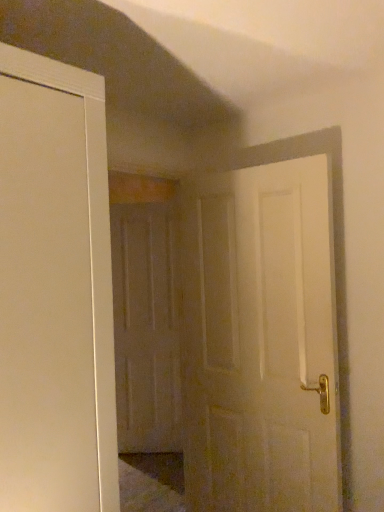
Question: Should I look upward or downward to see white matte door at center, which ranks as the first door in right-to-left order?

Choices:
 (A) up
 (B) down

Answer: (B)

Question: From the image's perspective, is white matte door at center, which ranks as the first door in right-to-left order, beneath matte wooden door at center, acting as the 2th door starting from the front?

Choices:
 (A) yes
 (B) no

Answer: (B)

Question: Is white matte door at center, positioned as the 2th door in back-to-front order, positioned before matte wooden door at center, which is the second door from right to left?

Choices:
 (A) yes
 (B) no

Answer: (A)

Question: Considering the relative sizes of white matte door at center, positioned as the 2th door in back-to-front order, and matte wooden door at center, which is the second door from right to left, in the image provided, is white matte door at center, positioned as the 2th door in back-to-front order, wider than matte wooden door at center, which is the second door from right to left,?

Choices:
 (A) no
 (B) yes

Answer: (B)

Question: Considering the relative positions of white matte door at center, positioned as the 2th door in back-to-front order, and matte wooden door at center, acting as the 2th door starting from the front, in the image provided, is white matte door at center, positioned as the 2th door in back-to-front order, to the right of matte wooden door at center, acting as the 2th door starting from the front, from the viewer's perspective?

Choices:
 (A) no
 (B) yes

Answer: (B)

Question: From a real-world perspective, does white matte door at center, which ranks as the first door in right-to-left order, sit lower than matte wooden door at center, which is counted as the 1th door, starting from the back?

Choices:
 (A) yes
 (B) no

Answer: (B)

Question: Can matte wooden door at center, which is the second door from right to left, be found inside white matte door at center, positioned as the 2th door in back-to-front order?

Choices:
 (A) no
 (B) yes

Answer: (A)

Question: Can you confirm if matte wooden door at center, which is counted as the 1th door, starting from the back, is bigger than white matte door at center, the 1th door viewed from the front?

Choices:
 (A) yes
 (B) no

Answer: (B)

Question: Can you see matte wooden door at center, acting as the 2th door starting from the front, touching white matte door at center, which ranks as the first door in right-to-left order?

Choices:
 (A) yes
 (B) no

Answer: (B)

Question: Is matte wooden door at center, which is counted as the 1th door, starting from the back, outside white matte door at center, positioned as the 2th door in back-to-front order?

Choices:
 (A) no
 (B) yes

Answer: (B)

Question: Can you confirm if matte wooden door at center, which is the second door from right to left, is shorter than white matte door at center, the 1th door viewed from the front?

Choices:
 (A) no
 (B) yes

Answer: (A)

Question: Considering the relative positions of matte wooden door at center, which is counted as the 1th door, starting from the back, and white matte door at center, placed as the 2th door when sorted from left to right, in the image provided, is matte wooden door at center, which is counted as the 1th door, starting from the back, to the right of white matte door at center, placed as the 2th door when sorted from left to right, from the viewer's perspective?

Choices:
 (A) yes
 (B) no

Answer: (B)

Question: Can you confirm if matte wooden door at center, which is counted as the 1th door, starting from the back, is wider than white matte door at center, which ranks as the first door in right-to-left order?

Choices:
 (A) no
 (B) yes

Answer: (A)

Question: From the image's perspective, is white matte door at center, positioned as the 2th door in back-to-front order, located above or below matte wooden door at center, acting as the 2th door starting from the front?

Choices:
 (A) above
 (B) below

Answer: (A)